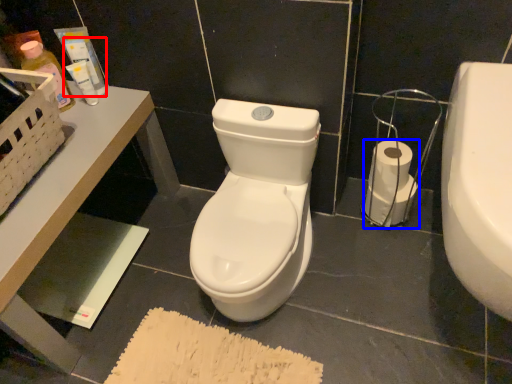
Question: Which object appears farthest to the camera in this image, toiletry (highlighted by a red box) or toilet paper (highlighted by a blue box)?

Choices:
 (A) toiletry
 (B) toilet paper

Answer: (B)